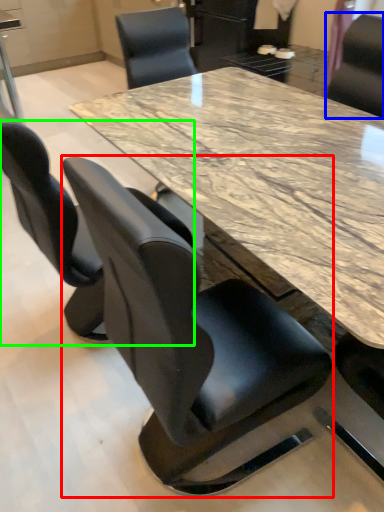
Question: Which object is positioned closest to chair (highlighted by a red box)? Select from chair (highlighted by a blue box) and chair (highlighted by a green box).

Choices:
 (A) chair
 (B) chair

Answer: (B)